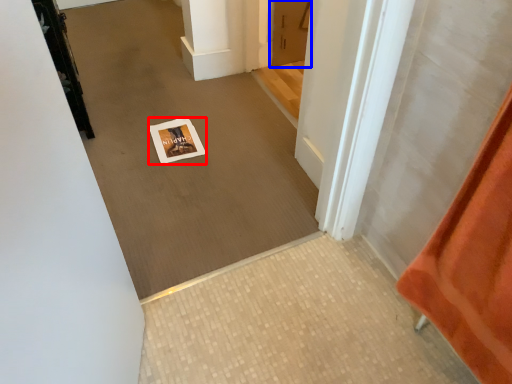
Question: Which object appears farthest to the camera in this image, postcard (highlighted by a red box) or door (highlighted by a blue box)?

Choices:
 (A) postcard
 (B) door

Answer: (B)